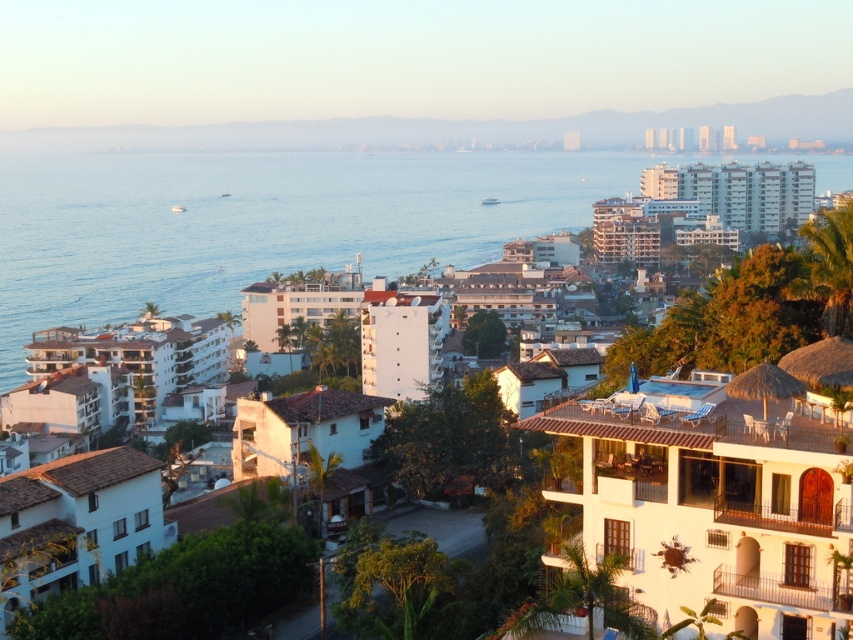
You are standing at the edge of a coastal city and want to take a photo of the white stucco buildings at upper center and the blue water at center. Which object will appear larger in your camera viewfinder?

The blue water at center will appear larger in the camera viewfinder because it is closer to the viewer than the white stucco buildings at upper center.

You are a photographer planning to capture a wide shot of the coastal cityscape. You want to ensure that both the blue water at center and the white stucco buildings at upper center are clearly visible in your composition. Based on their relative heights, which object should you position closer to the bottom of the frame to maintain their visibility?

Since the blue water at center is taller than the white stucco buildings at upper center, you should position the blue water at center closer to the bottom of the frame to ensure both elements remain visible in the composition.